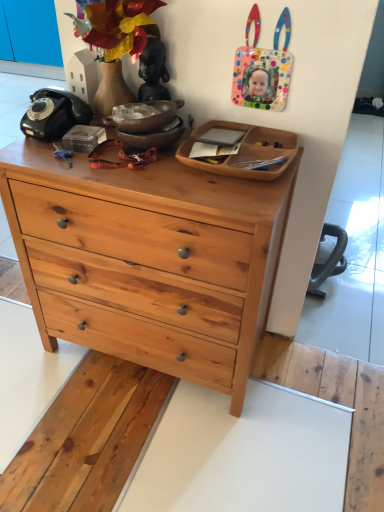
What is the approximate height of natural wood chest of drawers at center?

natural wood chest of drawers at center is 31.80 inches tall.

What do you see at coordinates (149, 260) in the screenshot?
I see `natural wood chest of drawers at center` at bounding box center [149, 260].

This screenshot has width=384, height=512. I want to click on natural wood chest of drawers at center, so click(x=149, y=260).

Describe the element at coordinates (244, 151) in the screenshot. The image size is (384, 512). I see `wooden tray at center` at that location.

In order to click on wooden tray at center in this screenshot , I will do `click(244, 151)`.

This screenshot has width=384, height=512. What are the coordinates of `natural wood chest of drawers at center` in the screenshot? It's located at (149, 260).

Does wooden tray at center appear on the left side of natural wood chest of drawers at center?

In fact, wooden tray at center is to the right of natural wood chest of drawers at center.

Which object is further away from the camera taking this photo, wooden tray at center or natural wood chest of drawers at center?

Positioned behind is wooden tray at center.

Does point (215, 125) lie behind point (231, 345)?

Yes, it is.

From the image's perspective, relative to natural wood chest of drawers at center, is wooden tray at center above or below?

From the image's perspective, wooden tray at center appears above natural wood chest of drawers at center.

From a real-world perspective, who is located higher, wooden tray at center or natural wood chest of drawers at center?

In real-world perspective, wooden tray at center is above.

Looking at their sizes, would you say wooden tray at center is wider or thinner than natural wood chest of drawers at center?

Considering their sizes, wooden tray at center looks slimmer than natural wood chest of drawers at center.

From the picture: Is wooden tray at center taller or shorter than natural wood chest of drawers at center?

wooden tray at center is shorter than natural wood chest of drawers at center.

Which of these two, wooden tray at center or natural wood chest of drawers at center, is smaller?

wooden tray at center.

Is wooden tray at center positioned beyond the bounds of natural wood chest of drawers at center?

wooden tray at center lies outside natural wood chest of drawers at center's area.

Is wooden tray at center placed right next to natural wood chest of drawers at center?

No, wooden tray at center is not making contact with natural wood chest of drawers at center.

Could you tell me if wooden tray at center is turned towards natural wood chest of drawers at center?

No, wooden tray at center is not turned towards natural wood chest of drawers at center.

Find the location of a particular element. This screenshot has width=384, height=512. chest of drawers below the wooden tray at center (from a real-world perspective) is located at coordinates (149, 260).

Can you confirm if natural wood chest of drawers at center is positioned to the left of wooden tray at center?

Yes, natural wood chest of drawers at center is to the left of wooden tray at center.

Which object is closer to the camera taking this photo, natural wood chest of drawers at center or wooden tray at center?

Positioned in front is natural wood chest of drawers at center.

Considering the positions of point (39, 324) and point (267, 141), is point (39, 324) closer or farther from the camera than point (267, 141)?

Point (39, 324).

From the image's perspective, which one is positioned higher, natural wood chest of drawers at center or wooden tray at center?

wooden tray at center appears higher in the image.

Looking at this image, from a real-world perspective, between natural wood chest of drawers at center and wooden tray at center, who is vertically lower?

In real-world perspective, natural wood chest of drawers at center is lower.

In terms of width, does natural wood chest of drawers at center look wider or thinner when compared to wooden tray at center?

Considering their sizes, natural wood chest of drawers at center looks broader than wooden tray at center.

Does natural wood chest of drawers at center have a greater height compared to wooden tray at center?

Yes, natural wood chest of drawers at center is taller than wooden tray at center.

Based on the photo, between natural wood chest of drawers at center and wooden tray at center, which one has larger size?

Bigger between the two is natural wood chest of drawers at center.

Is natural wood chest of drawers at center outside of wooden tray at center?

Yes.

Would you consider natural wood chest of drawers at center to be distant from wooden tray at center?

No, natural wood chest of drawers at center is not far from wooden tray at center.

Is natural wood chest of drawers at center looking in the opposite direction of wooden tray at center?

natural wood chest of drawers at center is not turned away from wooden tray at center.

How different are the orientations of natural wood chest of drawers at center and wooden tray at center in degrees?

natural wood chest of drawers at center and wooden tray at center are facing 0.0223 degrees away from each other.

Measure the distance from natural wood chest of drawers at center to wooden tray at center.

natural wood chest of drawers at center is 33.23 centimeters away from wooden tray at center.

Identify the location of chest of drawers on the left of wooden tray at center. The width and height of the screenshot is (384, 512). (149, 260).

Identify the location of cabinetry above the natural wood chest of drawers at center (from the image's perspective). (244, 151).

This screenshot has height=512, width=384. I want to click on chest of drawers to the left of wooden tray at center, so click(x=149, y=260).